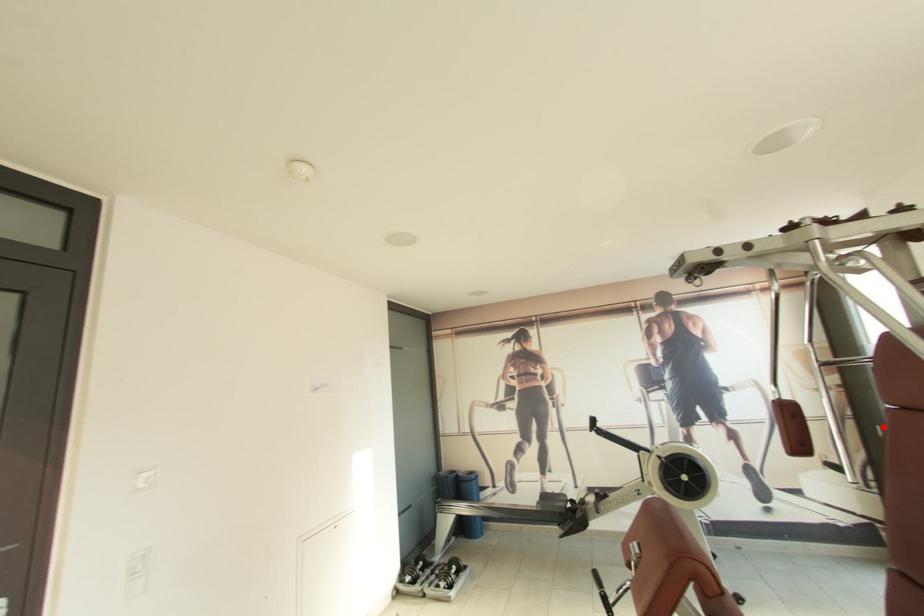
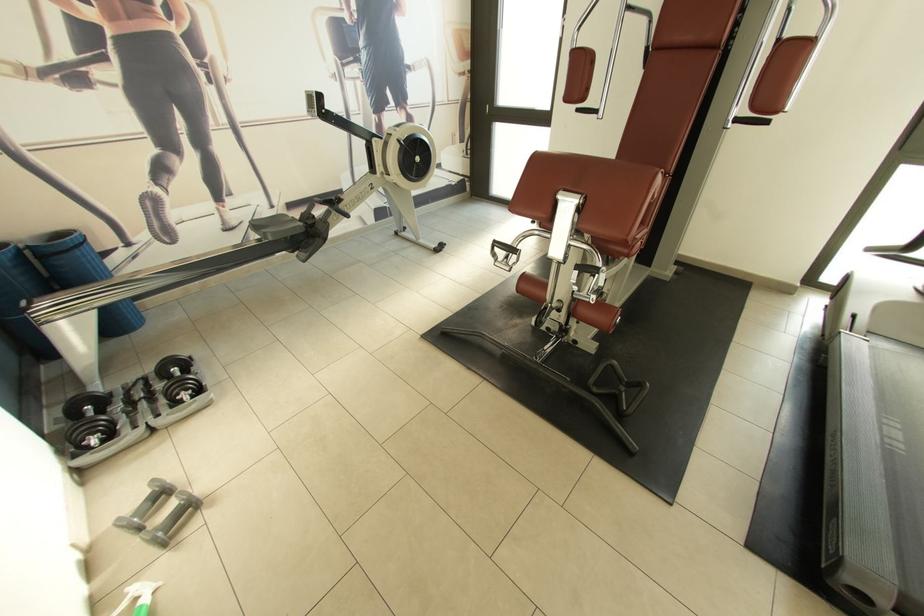
Question: I am providing you with two images of the same scene from different viewpoints. In image1, a red point is highlighted. Considering the same 3D point in image2, which of the following is correct?

Choices:
 (A) It is closer
 (B) It is farther

Answer: (A)